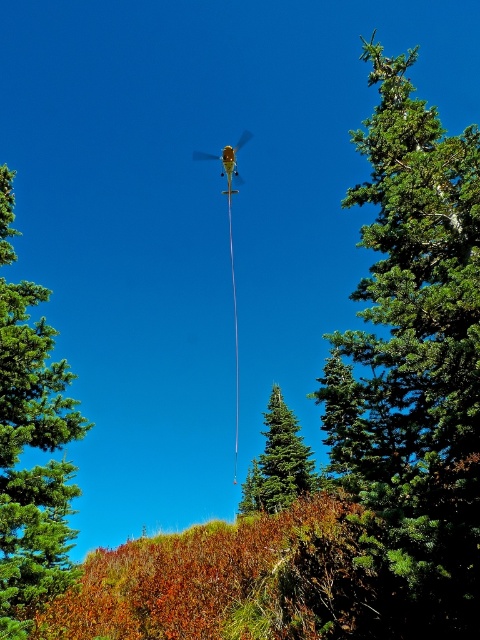
You are a pilot flying a helicopter and you see the green textured tree at upper right and the green matte tree at left. Which tree is higher in the sky?

The green textured tree at upper right is higher in the sky than the green matte tree at left.

You are a pilot flying a helicopter and notice two green matte trees in your view. The trees are labeled as the green matte tree at left and the green matte tree at center. From your perspective, which tree appears higher in the sky?

The green matte tree at left appears higher in the sky because it is positioned above the green matte tree at center according to their spatial arrangement.

You are a pilot flying a helicopter and need to avoid obstacles. The helicopter is at the upper middle part of the scene. There is a green textured tree at upper right. Based on their positions, which object is closer to the right edge of the image?

The green textured tree at upper right is closer to the right edge of the image because it is positioned at the upper right, while the helicopter is at the upper middle.